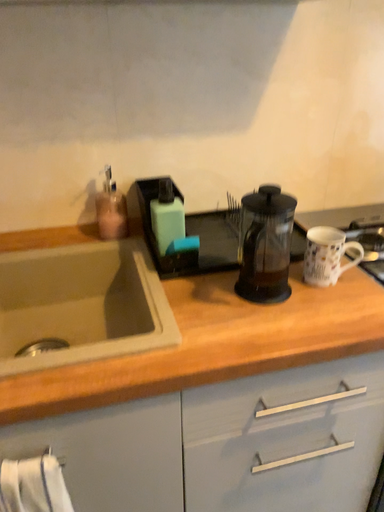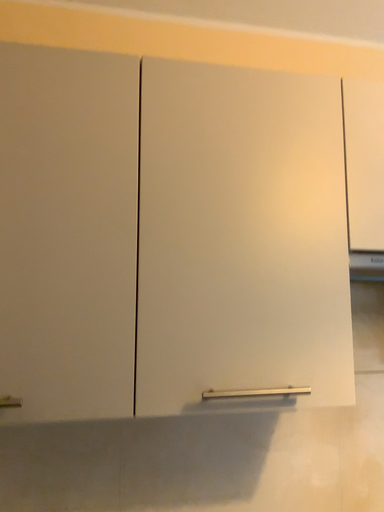
Question: How did the camera likely rotate when shooting the video?

Choices:
 (A) rotated upward
 (B) rotated downward

Answer: (A)